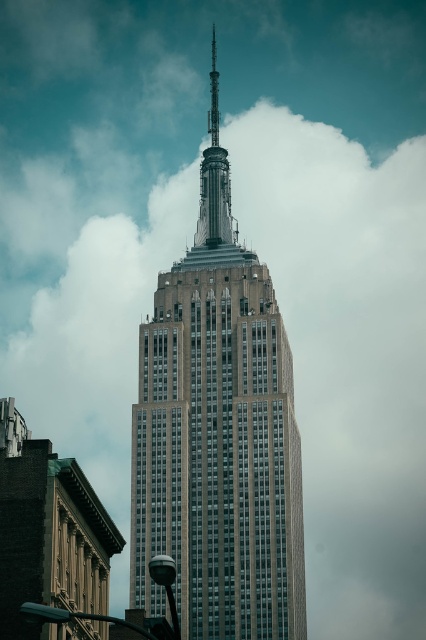
Question: Which point is closer to the camera?

Choices:
 (A) [x=262, y=301]
 (B) [x=213, y=192]

Answer: (A)

Question: Does gray stone tower at center have a greater width compared to polished silver spire at center?

Choices:
 (A) no
 (B) yes

Answer: (B)

Question: In this image, where is gray stone tower at center located relative to polished silver spire at center?

Choices:
 (A) left
 (B) right

Answer: (A)

Question: Does gray stone tower at center appear over polished silver spire at center?

Choices:
 (A) yes
 (B) no

Answer: (B)